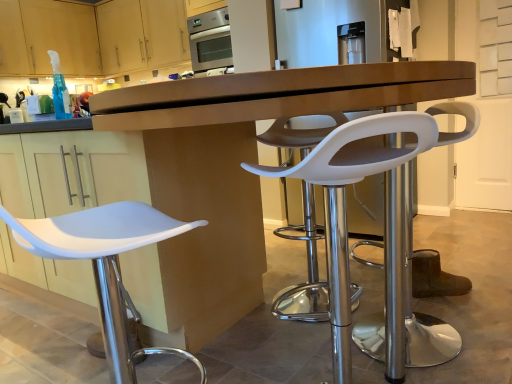
Question: Is translucent blue plastic spray bottle at upper left taller or shorter than white plastic stool at center, which is counted as the 3th chair, starting from the left?

Choices:
 (A) tall
 (B) short

Answer: (B)

Question: From the image's perspective, is translucent blue plastic spray bottle at upper left positioned above or below white plastic stool at center, the first chair in the right-to-left sequence?

Choices:
 (A) below
 (B) above

Answer: (B)

Question: Considering the real-world distances, which object is farthest from the white plastic stool at center, marked as the 2th chair in a right-to-left arrangement?

Choices:
 (A) white plastic stool at left, placed as the 3th chair when sorted from right to left
 (B) translucent blue plastic spray bottle at upper left
 (C) white plastic stool at center, the first chair in the right-to-left sequence
 (D) matte wood cabinet at upper left, the 1th cabinetry when ordered from left to right
 (E) matte wood cabinets at upper left, placed as the 2th cabinetry when sorted from left to right

Answer: (D)

Question: Which is farther from the white plastic stool at left, which is counted as the first chair, starting from the left?

Choices:
 (A) translucent blue plastic spray bottle at upper left
 (B) white plastic stool at center, the first chair in the right-to-left sequence
 (C) matte wood cabinet at upper left, the 1th cabinetry when ordered from left to right
 (D) matte brown desk at center
 (E) matte wood cabinets at upper left, arranged as the 1th cabinetry when viewed from the right

Answer: (C)